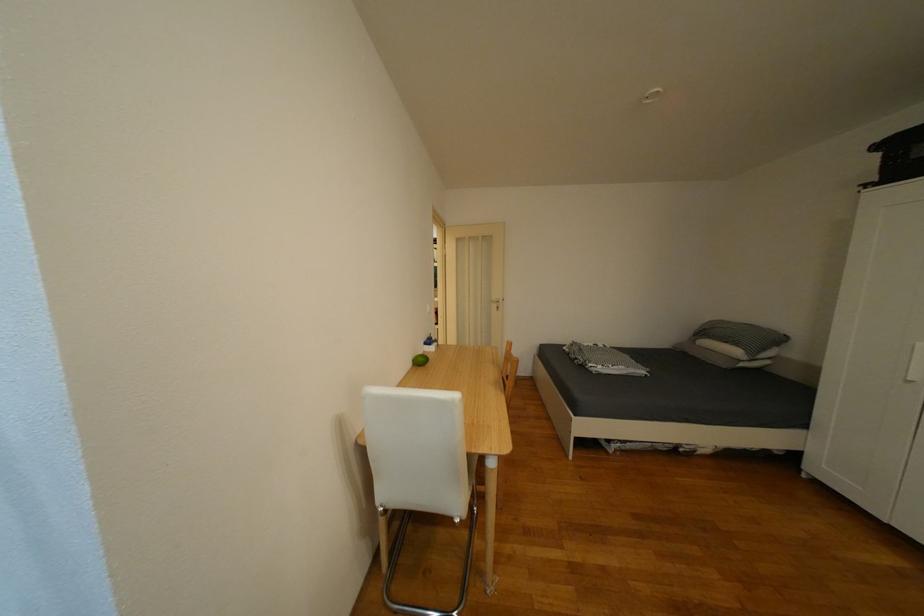
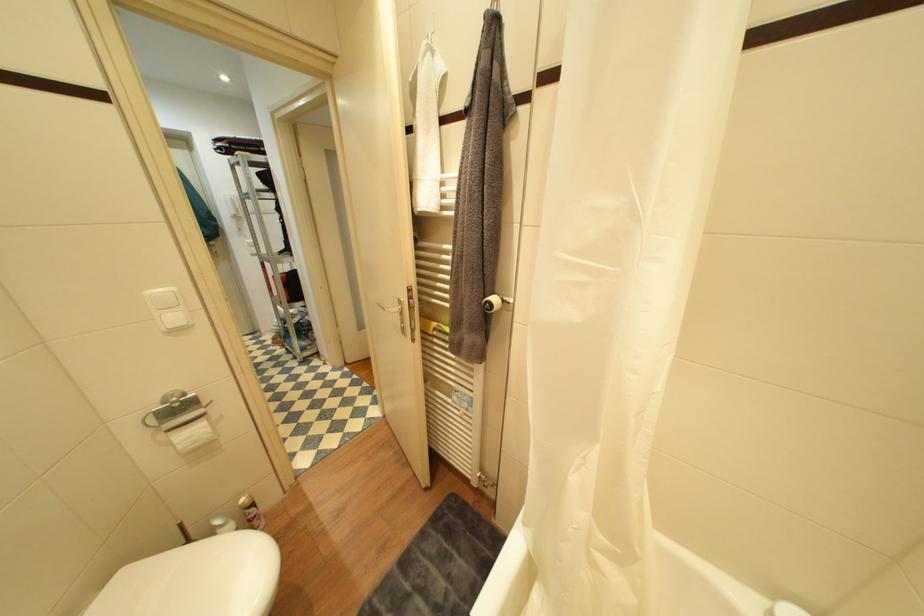
Question: I am providing you with two images of the same scene from different viewpoints. After the viewpoint changes to image2, which objects are now occluded?

Choices:
 (A) silver door handle
 (B) dark grey cushion
 (C) grey pillow
 (D) aerosol spray can

Answer: (C)